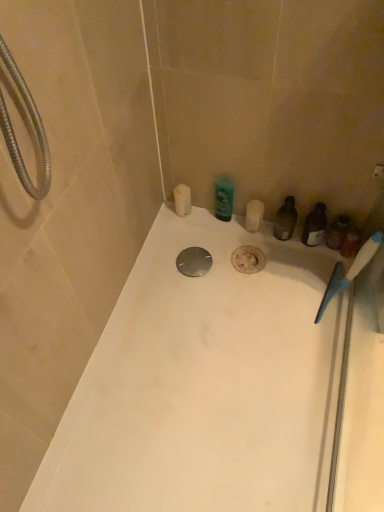
Question: Can you confirm if white glossy bathtub at center is shorter than translucent plastic bottle at right?

Choices:
 (A) yes
 (B) no

Answer: (A)

Question: Considering the relative sizes of white glossy bathtub at center and translucent plastic bottle at right in the image provided, is white glossy bathtub at center smaller than translucent plastic bottle at right?

Choices:
 (A) yes
 (B) no

Answer: (B)

Question: Is the position of white glossy bathtub at center more distant than that of translucent plastic bottle at right?

Choices:
 (A) no
 (B) yes

Answer: (A)

Question: Is the surface of white glossy bathtub at center in direct contact with translucent plastic bottle at right?

Choices:
 (A) no
 (B) yes

Answer: (A)

Question: Is white glossy bathtub at center located outside translucent plastic bottle at right?

Choices:
 (A) no
 (B) yes

Answer: (B)

Question: Does white glossy bathtub at center appear on the left side of translucent plastic bottle at right?

Choices:
 (A) yes
 (B) no

Answer: (A)

Question: Does translucent plastic container at right, which is the 1th toiletry from right to left, have a greater height compared to white glossy bathtub at center?

Choices:
 (A) no
 (B) yes

Answer: (B)

Question: Is translucent plastic container at right, which is the 1th toiletry from right to left, positioned beyond the bounds of white glossy bathtub at center?

Choices:
 (A) yes
 (B) no

Answer: (A)

Question: Is translucent plastic container at right, the 3th toiletry positioned from the left, turned away from white glossy bathtub at center?

Choices:
 (A) yes
 (B) no

Answer: (B)

Question: Is translucent plastic container at right, the 3th toiletry positioned from the left, not near white glossy bathtub at center?

Choices:
 (A) yes
 (B) no

Answer: (B)

Question: From a real-world perspective, is translucent plastic container at right, which is the 1th toiletry from right to left, physically below white glossy bathtub at center?

Choices:
 (A) no
 (B) yes

Answer: (A)

Question: From a real-world perspective, is translucent plastic container at right, the 3th toiletry positioned from the left, positioned over white glossy bathtub at center based on gravity?

Choices:
 (A) yes
 (B) no

Answer: (A)

Question: Is white matte candle at upper left, placed as the 3th toiletry when sorted from right to left, further to camera compared to green glossy bottle at center, acting as the second toiletry starting from the left?

Choices:
 (A) yes
 (B) no

Answer: (A)